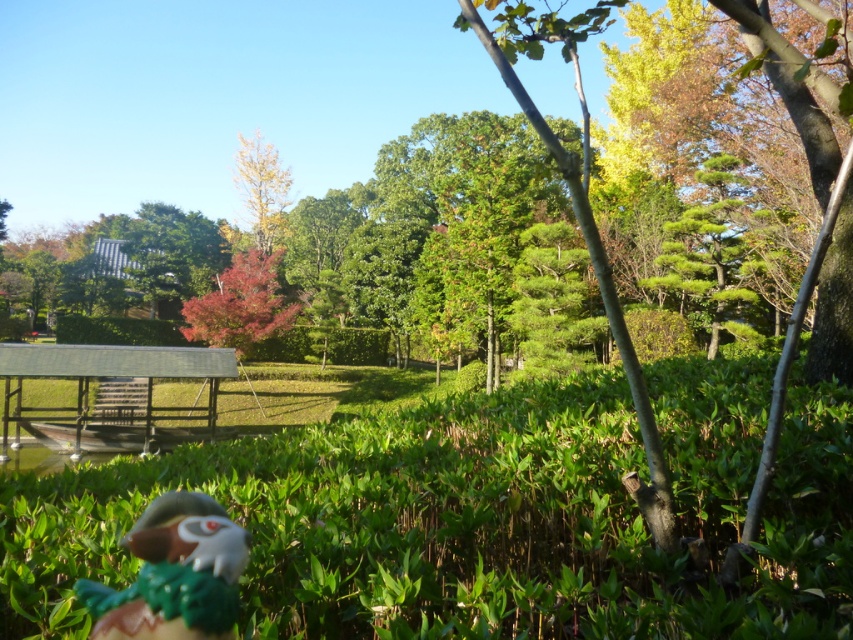
You are a child playing in the park and you see the shiny plastic bird at lower left and the vivid red leaves at center. Which object is located more to the left?

The vivid red leaves at center are more to the left than the shiny plastic bird at lower left.

You are a gardener trying to place a new decorative item in the park. The shiny plastic bird at lower left and the vivid red leaves at center are already present. Which object would require a narrower space between two trees to fit through?

The shiny plastic bird at lower left is thinner than the vivid red leaves at center, so it would require a narrower space between two trees to fit through.